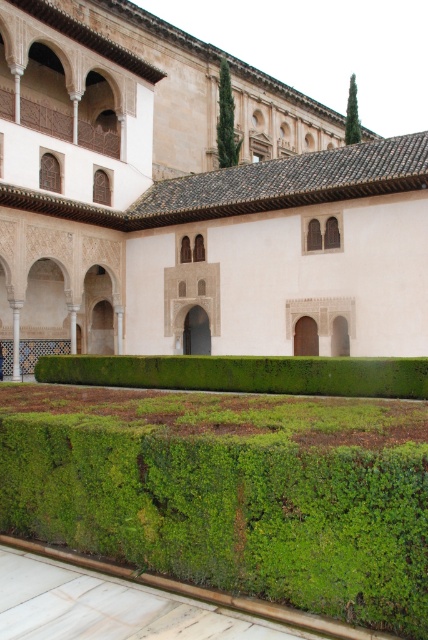
Question: Where is green mossy hedge at center located in relation to green leafy hedge at center in the image?

Choices:
 (A) above
 (B) below

Answer: (A)

Question: From the image, what is the correct spatial relationship of green mossy hedge at center in relation to green leafy hedge at center?

Choices:
 (A) left
 (B) right

Answer: (A)

Question: Can you confirm if green mossy hedge at center is positioned above green leafy hedge at center?

Choices:
 (A) no
 (B) yes

Answer: (B)